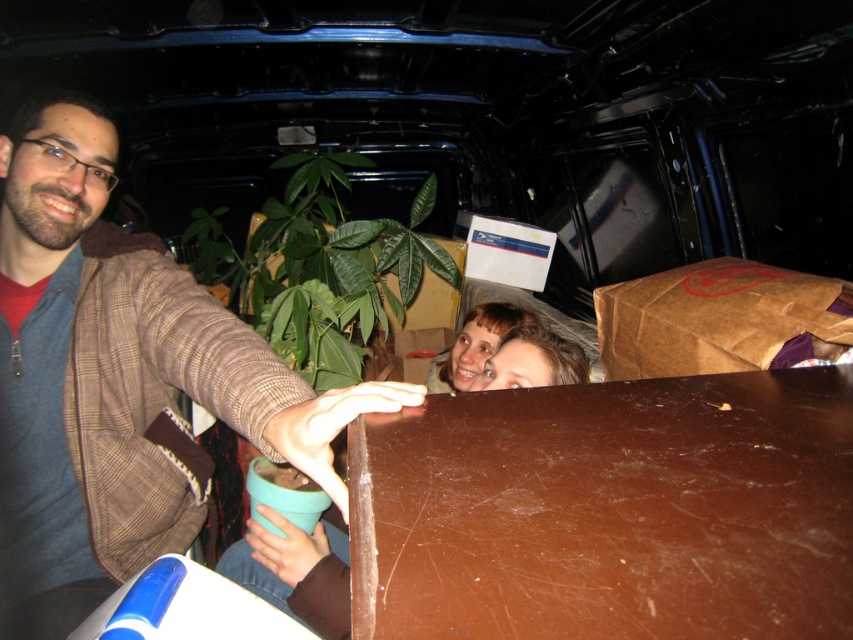
At what (x,y) coordinates should I click in order to perform the action: click on brown matte table at center. Please return your answer as a coordinate pair (x, y). Looking at the image, I should click on (608, 509).

Which is behind, point (445, 470) or point (303, 534)?

Positioned behind is point (303, 534).

Locate an element on the screen. brown matte table at center is located at coordinates (608, 509).

Is point (340, 564) behind point (548, 364)?

That is False.

Between point (554, 337) and point (492, 369), which one is positioned in front?

Positioned in front is point (492, 369).

Image resolution: width=853 pixels, height=640 pixels. Find the location of `smooth brown wooden table at center`. smooth brown wooden table at center is located at coordinates 294,572.

Can you confirm if brown matte table at center is positioned below brown plaid jacket at left?

Actually, brown matte table at center is above brown plaid jacket at left.

Does brown matte table at center come in front of brown plaid jacket at left?

Yes, brown matte table at center is in front of brown plaid jacket at left.

Measure the distance between point (550, 596) and camera.

A distance of 14.91 inches exists between point (550, 596) and camera.

You are a GUI agent. You are given a task and a screenshot of the screen. Output one action in this format:
    pyautogui.click(x=<x>, y=<y>)
    Task: Click on the brown matte table at center
    Image resolution: width=853 pixels, height=640 pixels.
    Given the screenshot: What is the action you would take?
    pyautogui.click(x=608, y=509)